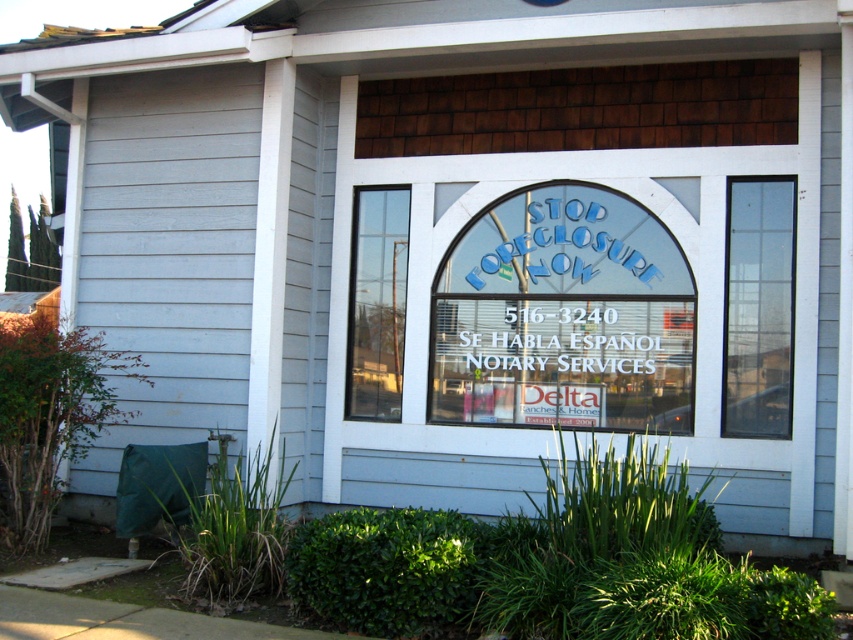
Does white plastic sign at center have a greater height compared to clear glass window at right?

No, white plastic sign at center is not taller than clear glass window at right.

Is point (650, 321) positioned in front of point (740, 205)?

No, it is not.

Where is `white plastic sign at center`? white plastic sign at center is located at coordinates (555, 339).

Does clear glass window at right have a lesser height compared to clear glass door at center?

No, clear glass window at right is not shorter than clear glass door at center.

Which is above, clear glass window at right or clear glass door at center?

clear glass door at center is above.

Is point (738, 246) positioned before point (398, 200)?

Yes.

The width and height of the screenshot is (853, 640). I want to click on clear glass window at right, so click(x=758, y=307).

Does white plastic sign at center have a lesser width compared to clear glass door at center?

No.

Is white plastic sign at center to the left of clear glass door at center from the viewer's perspective?

Incorrect, white plastic sign at center is not on the left side of clear glass door at center.

Does point (451, 369) lie in front of point (383, 198)?

Yes, point (451, 369) is in front of point (383, 198).

Where is `white plastic sign at center`? white plastic sign at center is located at coordinates (555, 339).